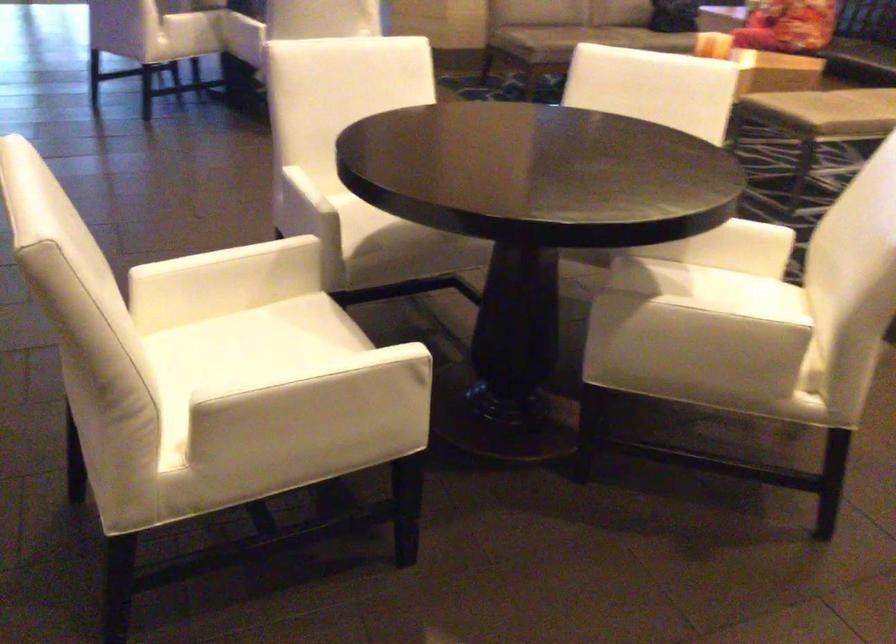
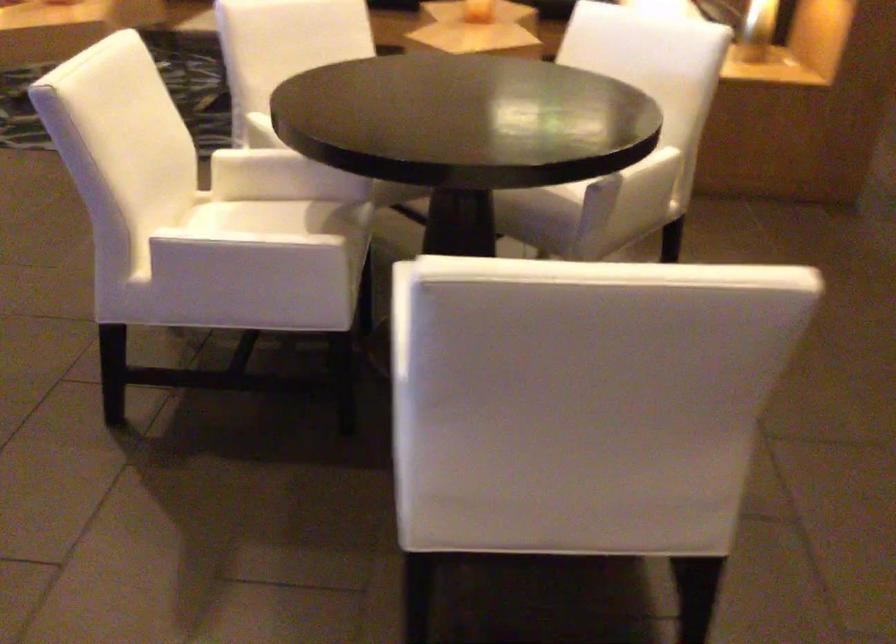
Find the pixel in the second image that matches point (567, 254) in the first image.

(385, 199)